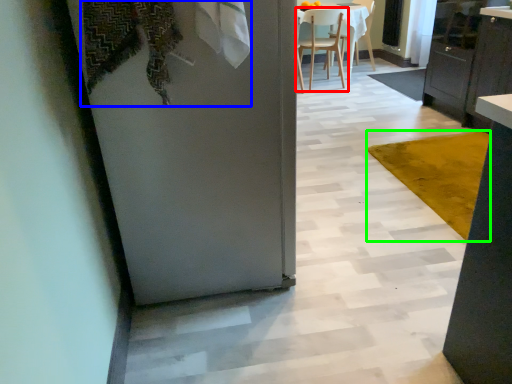
Question: Estimate the real-world distances between objects in this image. Which object is farther from chair (highlighted by a red box), laundry (highlighted by a blue box) or mat (highlighted by a green box)?

Choices:
 (A) laundry
 (B) mat

Answer: (A)